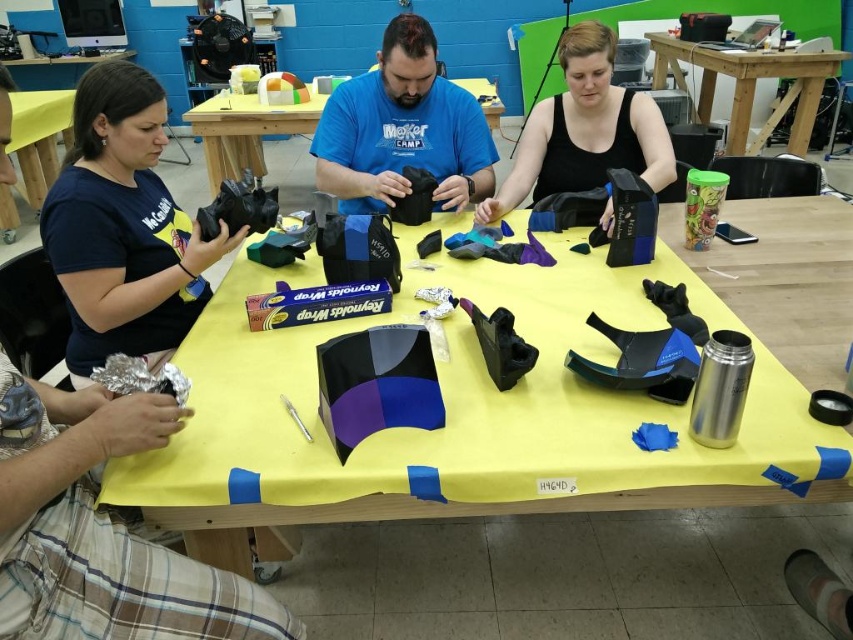
In the scene shown: You are a participant in the crafting workshop and need to compare the height of the matte black fabric at center and the yellow fabric at upper left. Which one is taller?

The yellow fabric at upper left is taller than the matte black fabric at center.

You are a photographer setting up equipment for a photoshoot. You have a matte black camera at left and a yellow fabric at upper left. Which object is located below the other?

The matte black camera at left is positioned under the yellow fabric at upper left, so the camera is below the fabric.